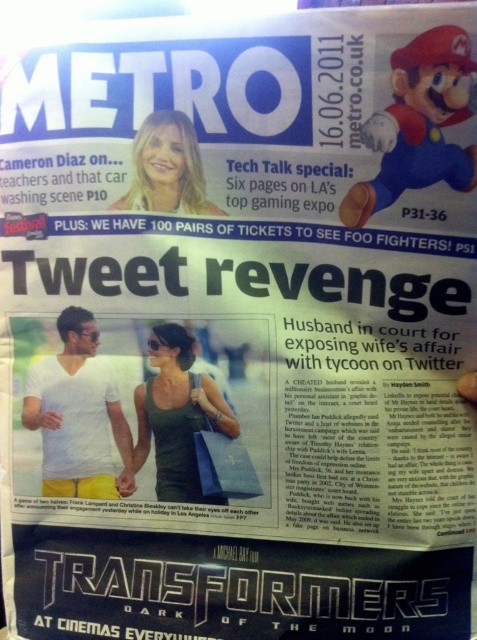
Which is below, white matte t-shirt at center or matte white face at upper center?

white matte t-shirt at center is below.

Can you confirm if white matte t-shirt at center is thinner than matte white face at upper center?

No, white matte t-shirt at center is not thinner than matte white face at upper center.

Who is more distant from viewer, (62, 422) or (138, 205)?

Point (62, 422)

Where is `white matte t-shirt at center`? white matte t-shirt at center is located at coordinates (79, 416).

Does green matte tank top at center have a smaller size compared to matte white face at upper center?

Actually, green matte tank top at center might be larger than matte white face at upper center.

Is the position of green matte tank top at center less distant than that of matte white face at upper center?

No, it is not.

Who is more distant from viewer, (159, 486) or (184, 157)?

The point (159, 486) is more distant.

Locate an element on the screen. This screenshot has width=477, height=640. green matte tank top at center is located at coordinates (176, 416).

Does white matte t-shirt at center have a greater height compared to green matte tank top at center?

Yes, white matte t-shirt at center is taller than green matte tank top at center.

Who is more forward, (132,477) or (203,420)?

Point (203,420)

This screenshot has width=477, height=640. I want to click on white matte t-shirt at center, so click(79, 416).